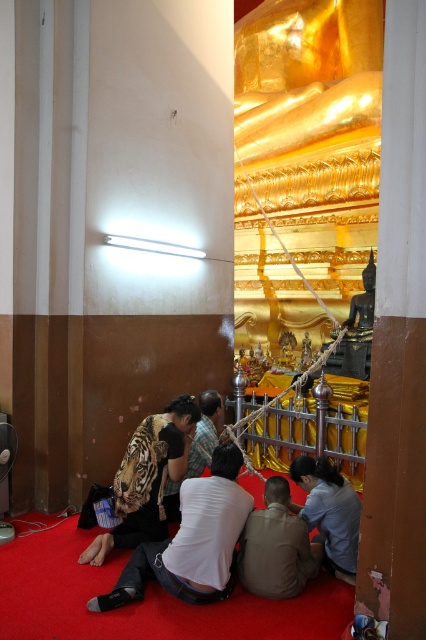
Who is taller, printed tiger-patterned shirt at lower left or brown matte shirt at lower center?

printed tiger-patterned shirt at lower left

Does printed tiger-patterned shirt at lower left have a greater height compared to brown matte shirt at lower center?

Indeed, printed tiger-patterned shirt at lower left has a greater height compared to brown matte shirt at lower center.

Does point (149, 547) lie behind point (322, 548)?

That is False.

Find the location of a particular element. Image resolution: width=426 pixels, height=640 pixels. printed tiger-patterned shirt at lower left is located at coordinates (192, 540).

Is printed tiger-patterned shirt at lower left below striped fur tiger at lower left?

Yes.

Can you confirm if printed tiger-patterned shirt at lower left is wider than striped fur tiger at lower left?

Yes, printed tiger-patterned shirt at lower left is wider than striped fur tiger at lower left.

Is point (206, 536) positioned in front of point (135, 467)?

Yes, it is in front of point (135, 467).

At what (x,y) coordinates should I click in order to perform the action: click on printed tiger-patterned shirt at lower left. Please return your answer as a coordinate pair (x, y). The width and height of the screenshot is (426, 640). Looking at the image, I should click on (192, 540).

Between point (314, 557) and point (322, 461), which one is positioned behind?

The point (322, 461) is more distant.

Does point (278, 516) come farther from viewer compared to point (350, 497)?

That is False.

The width and height of the screenshot is (426, 640). Find the location of `brown matte shirt at lower center`. brown matte shirt at lower center is located at coordinates (276, 547).